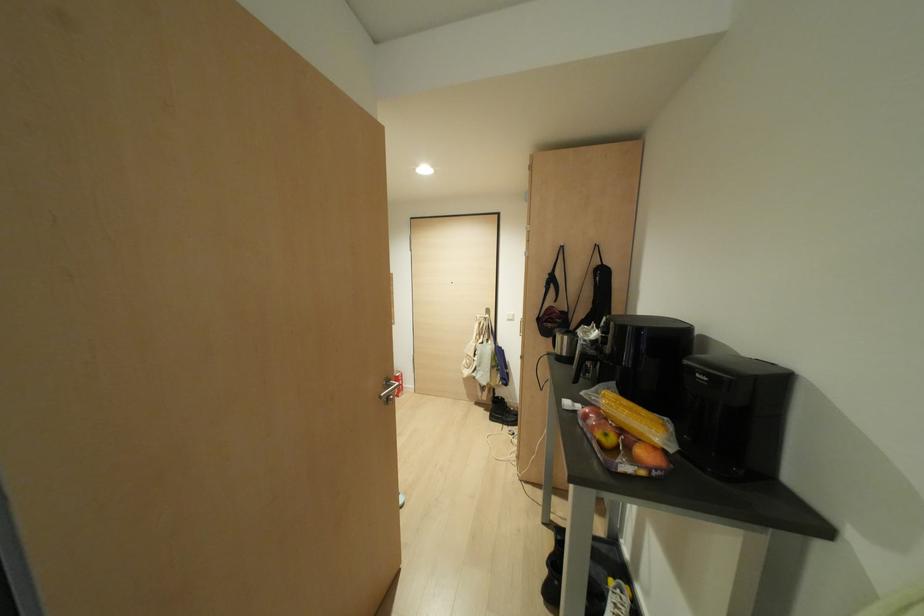
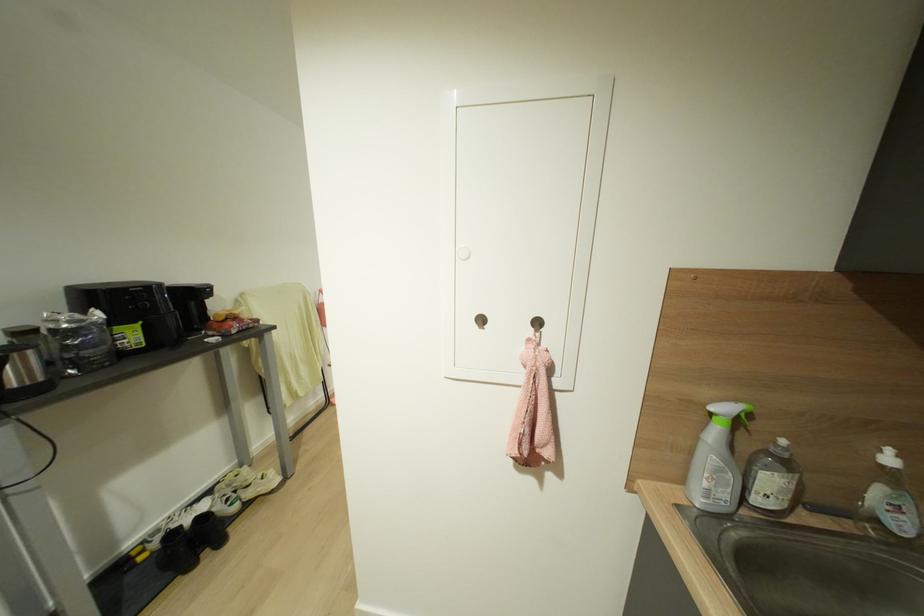
Question: I am providing you with two images of the same scene from different viewpoints. Which of the following objects are not visible in image2?

Choices:
 (A) green spray trigger
 (B) purple and yellow book
 (C) black hanging bag
 (D) soap dispenser pump

Answer: (C)